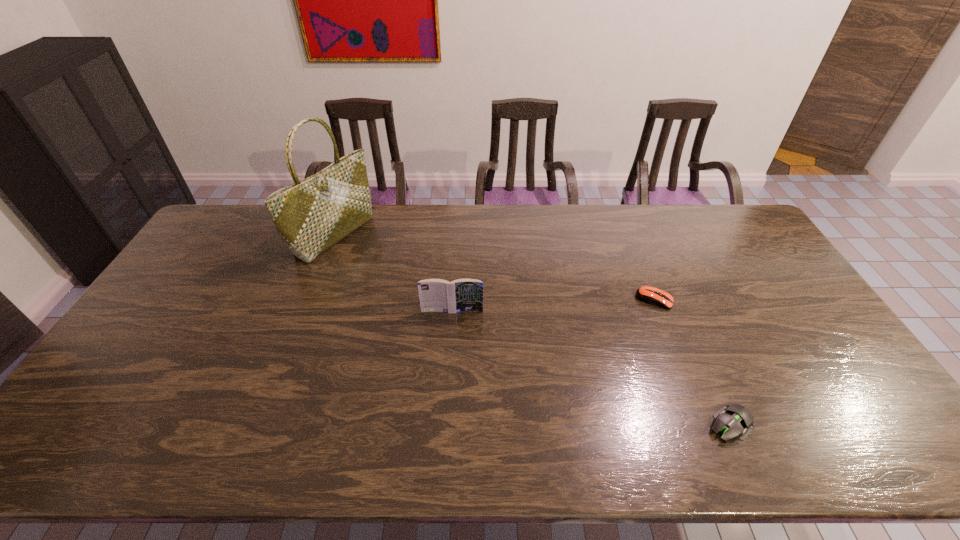
The image size is (960, 540). I want to click on shopping bag, so (312, 215).

Locate an element on the screen. The width and height of the screenshot is (960, 540). the leftmost object is located at coordinates (312, 215).

Where is `book`? book is located at coordinates (436, 295).

What are the coordinates of `the second tallest object` in the screenshot? It's located at (436, 295).

Where is `the farther computer mouse`? Image resolution: width=960 pixels, height=540 pixels. the farther computer mouse is located at coordinates (647, 294).

At what (x,y) coordinates should I click in order to perform the action: click on the nearest object. Please return your answer as a coordinate pair (x, y). The width and height of the screenshot is (960, 540). Looking at the image, I should click on (734, 420).

Find the location of a particular element. blank area located on the left of the leftmost object is located at coordinates (217, 236).

The height and width of the screenshot is (540, 960). Find the location of `vacant space situated 0.200m on the front cover of the second object from left to right`. vacant space situated 0.200m on the front cover of the second object from left to right is located at coordinates coord(448,370).

At what (x,y) coordinates should I click in order to perform the action: click on vacant space located on the back of the farther computer mouse. Please return your answer as a coordinate pair (x, y). The height and width of the screenshot is (540, 960). Looking at the image, I should click on (641, 265).

The width and height of the screenshot is (960, 540). In order to click on vacant space located 0.250m on the back of the nearest object in this screenshot , I will do `click(687, 327)`.